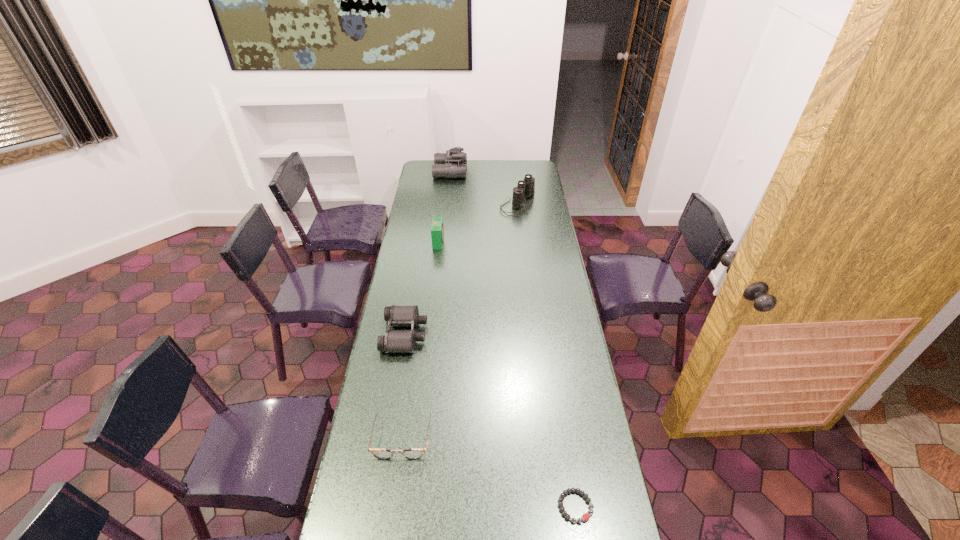
This screenshot has height=540, width=960. In order to click on blank region between the fourth tallest object and the rightmost binoculars in this screenshot , I will do `click(462, 269)`.

Locate an element on the screen. This screenshot has width=960, height=540. empty space between the bracelet and the fourth nearest object is located at coordinates (507, 374).

At what (x,y) coordinates should I click in order to perform the action: click on free spot between the rightmost binoculars and the shortest binoculars. Please return your answer as a coordinate pair (x, y). Looking at the image, I should click on (462, 269).

I want to click on vacant space that is in between the shortest object and the farthest binoculars, so click(513, 339).

The width and height of the screenshot is (960, 540). What are the coordinates of `free area in between the fifth nearest object and the shortest object` in the screenshot? It's located at click(x=547, y=355).

Find the location of `unoccupied area between the bracelet and the spectacles`. unoccupied area between the bracelet and the spectacles is located at coordinates coord(489,472).

In order to click on object that is the fifth closest to the farthest object in this screenshot , I will do `click(585, 517)`.

In order to click on object that stands as the fifth closest to the fourth nearest object in this screenshot , I will do `click(585, 517)`.

This screenshot has width=960, height=540. In order to click on binoculars that is the nearest to the rightmost binoculars in this screenshot , I will do click(452, 164).

You are a GUI agent. You are given a task and a screenshot of the screen. Output one action in this format:
    pyautogui.click(x=<x>, y=<y>)
    Task: Click on the closest binoculars to the nearest object
    The image size is (960, 540).
    Given the screenshot: What is the action you would take?
    pyautogui.click(x=394, y=341)